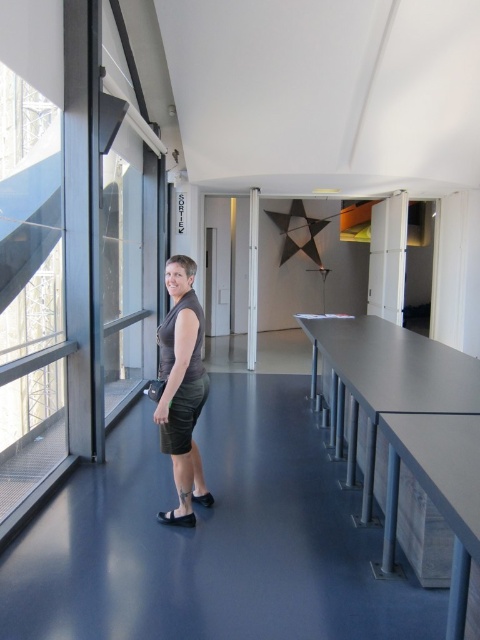
Question: Is matte black skirt at center smaller than white glossy pillar at center?

Choices:
 (A) no
 (B) yes

Answer: (A)

Question: From the image, what is the correct spatial relationship of dark green textured dress at center in relation to black leather sandal at lower center?

Choices:
 (A) left
 (B) right

Answer: (A)

Question: Observing the image, what is the correct spatial positioning of dark green textured dress at center in reference to black suede sandal at lower center?

Choices:
 (A) right
 (B) left

Answer: (A)

Question: Which object appears closest to the camera in this image?

Choices:
 (A) matte black skirt at center
 (B) dark green textured dress at center

Answer: (A)

Question: Which of these objects is positioned farthest from the white glossy pillar at center?

Choices:
 (A) matte black skirt at center
 (B) black leather sandal at lower center
 (C) black suede sandal at lower center
 (D) dark green textured dress at center

Answer: (C)

Question: Which object is the closest to the white glossy pillar at center?

Choices:
 (A) dark green textured dress at center
 (B) matte black skirt at center
 (C) black suede sandal at lower center

Answer: (B)